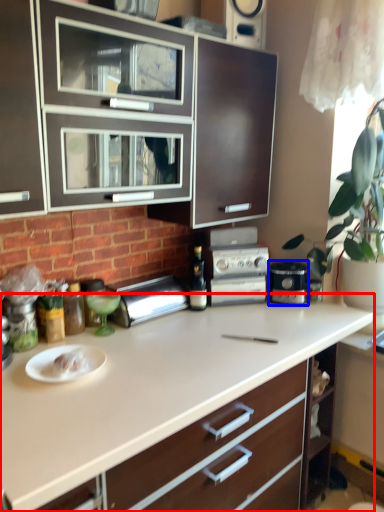
Question: Among these objects, which one is farthest to the camera, countertop (highlighted by a red box) or home appliance (highlighted by a blue box)?

Choices:
 (A) countertop
 (B) home appliance

Answer: (B)